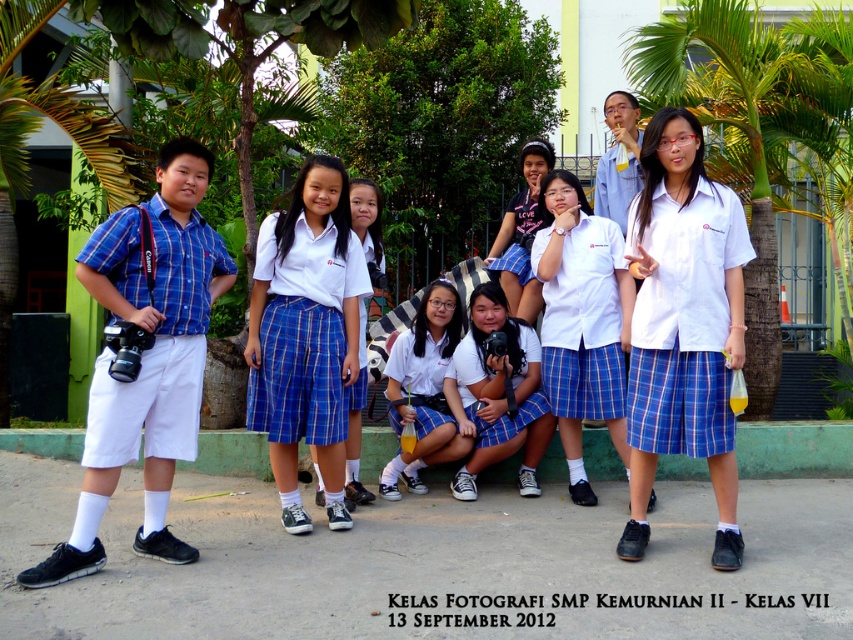
Consider the image. Which is more to the left, blue plaid shirt at left or white glossy skirt at center?

Positioned to the left is blue plaid shirt at left.

Is blue plaid shirt at left positioned at the back of white glossy skirt at center?

No, blue plaid shirt at left is closer to the viewer.

Which is behind, point (100, 304) or point (384, 476)?

Positioned behind is point (384, 476).

The width and height of the screenshot is (853, 640). I want to click on blue plaid shirt at left, so click(146, 358).

Is blue plaid skirt at center further to the viewer compared to matte black shirt at center?

No, blue plaid skirt at center is in front of matte black shirt at center.

Measure the distance between blue plaid skirt at center and matte black shirt at center.

blue plaid skirt at center is 6.65 feet from matte black shirt at center.

Who is more forward, (318, 410) or (515, 205)?

Point (318, 410) is in front.

Where is `blue plaid skirt at center`? The width and height of the screenshot is (853, 640). blue plaid skirt at center is located at coordinates (306, 333).

Looking at this image, measure the distance between point (642, 259) and camera.

Point (642, 259) is 15.15 feet away from camera.

Does white plaid skirt at center appear on the left side of blue plaid skirt at center?

No, white plaid skirt at center is not to the left of blue plaid skirt at center.

Find the location of a particular element. The width and height of the screenshot is (853, 640). white plaid skirt at center is located at coordinates (683, 324).

This screenshot has height=640, width=853. I want to click on white plaid skirt at center, so click(x=683, y=324).